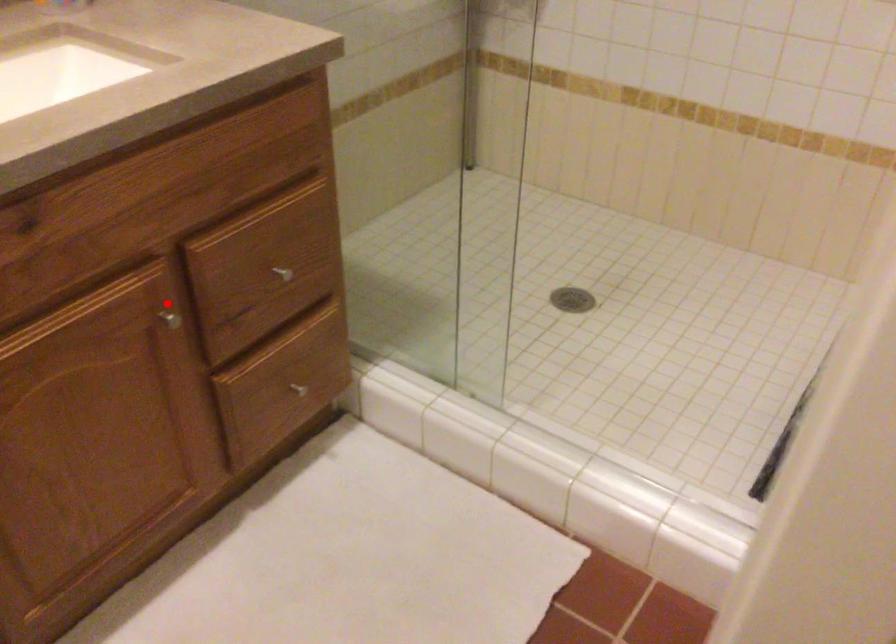
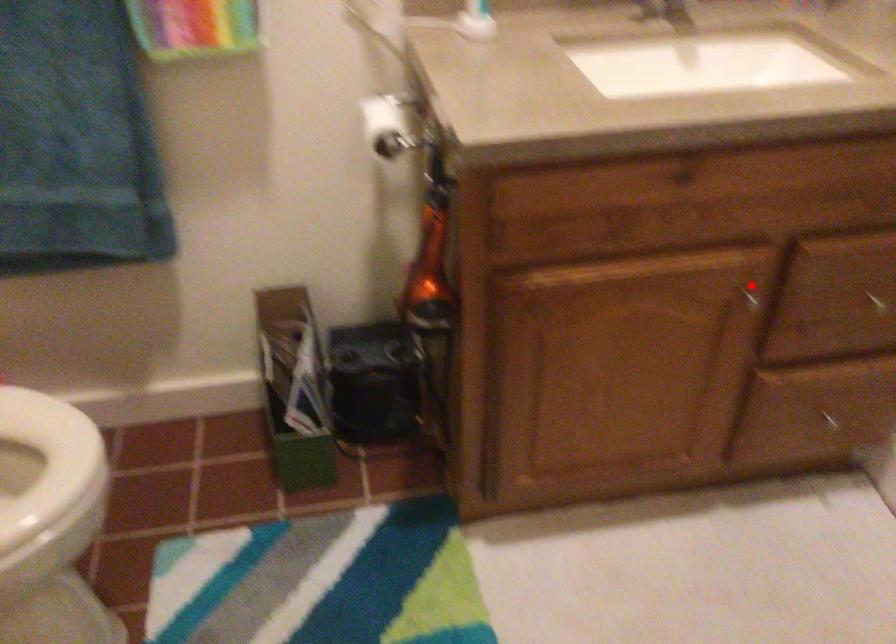
I am providing you with two images of the same scene from different viewpoints. A red point is marked on the first image and another point is marked on the second image. Do the highlighted points in image1 and image2 indicate the same real-world spot?

Yes